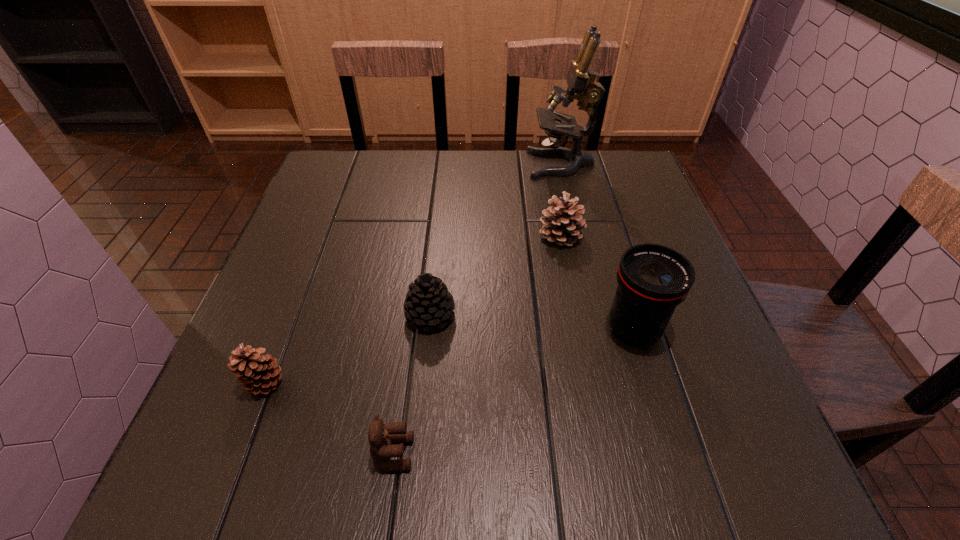
This screenshot has height=540, width=960. Identify the location of pinecone that is the second nearest to the second farthest object. (257, 373).

Select which pinecone is the closest to the leftmost object. Please provide its 2D coordinates. Your answer should be formatted as a tuple, i.e. [(x, y)], where the tuple contains the x and y coordinates of a point satisfying the conditions above.

[(428, 303)]

At what (x,y) coordinates should I click in order to perform the action: click on vacant space that satisfies the following two spatial constraints: 1. at the eyepieces of the fifth shortest object; 2. on the left side of the farthest object. Please return your answer as a coordinate pair (x, y). This screenshot has height=540, width=960. Looking at the image, I should click on (600, 329).

Find the location of a particular element. vacant space that satisfies the following two spatial constraints: 1. at the narrow end of the second farthest pinecone; 2. on the face of the teddy bear is located at coordinates (417, 454).

Where is `vacant point that satisfies the following two spatial constraints: 1. at the eyepieces of the farthest object; 2. on the front side of the leftmost pinecone`? vacant point that satisfies the following two spatial constraints: 1. at the eyepieces of the farthest object; 2. on the front side of the leftmost pinecone is located at coordinates (612, 383).

What are the coordinates of `vacant space that satisfies the following two spatial constraints: 1. on the back side of the farthest pinecone; 2. on the right side of the nearest pinecone` in the screenshot? It's located at (321, 235).

The width and height of the screenshot is (960, 540). In order to click on vacant space that satisfies the following two spatial constraints: 1. on the front side of the farthest pinecone; 2. on the face of the teddy bear in this screenshot , I will do `click(604, 454)`.

You are a GUI agent. You are given a task and a screenshot of the screen. Output one action in this format:
    pyautogui.click(x=<x>, y=<y>)
    Task: Click on the vacant space that satisfies the following two spatial constraints: 1. on the back side of the telephoto lens; 2. on the right side of the second nearest object
    Image resolution: width=960 pixels, height=540 pixels.
    Given the screenshot: What is the action you would take?
    pyautogui.click(x=285, y=329)